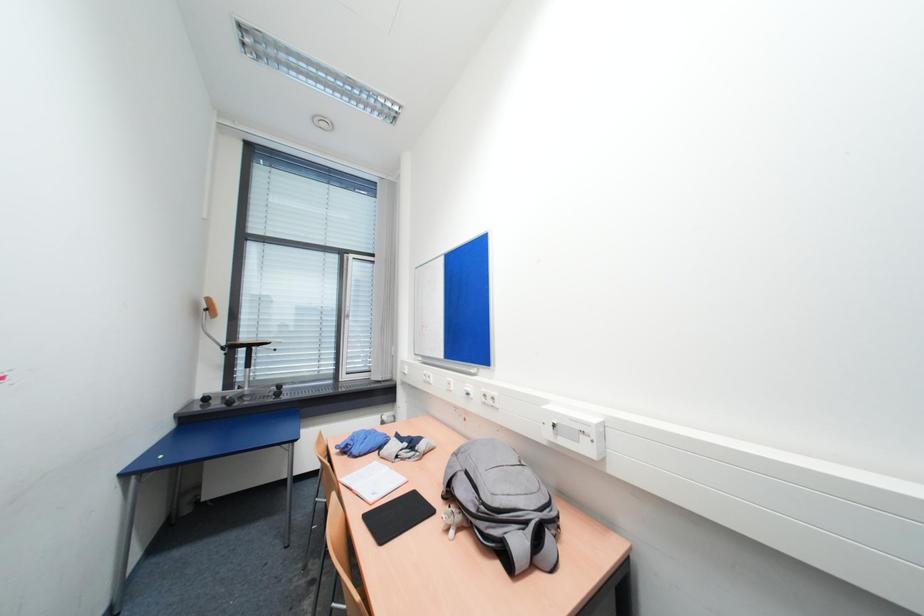
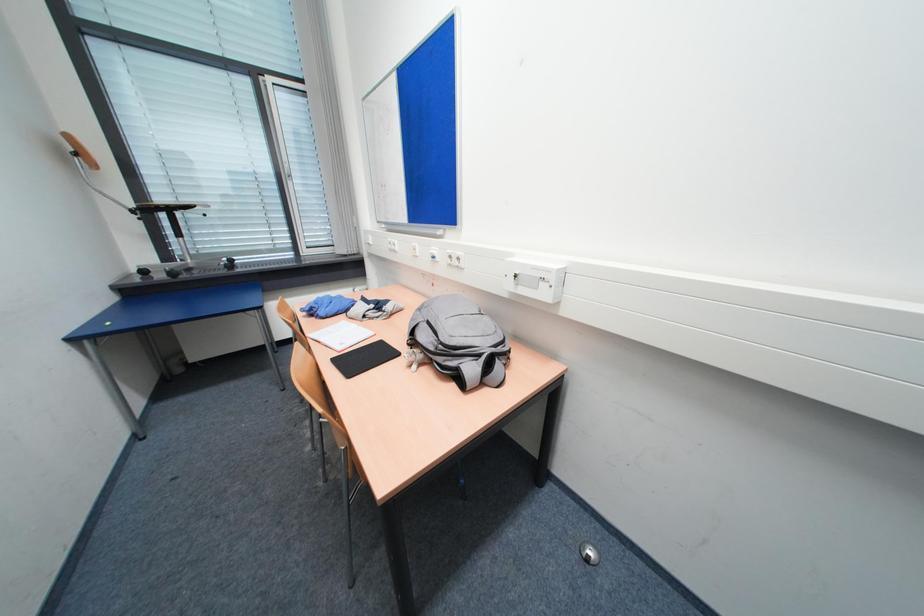
Question: Based on the continuous images, in which direction is the camera rotating? Reply with the corresponding letter.

Choices:
 (A) Left
 (B) Right
 (C) Up
 (D) Down

Answer: (D)